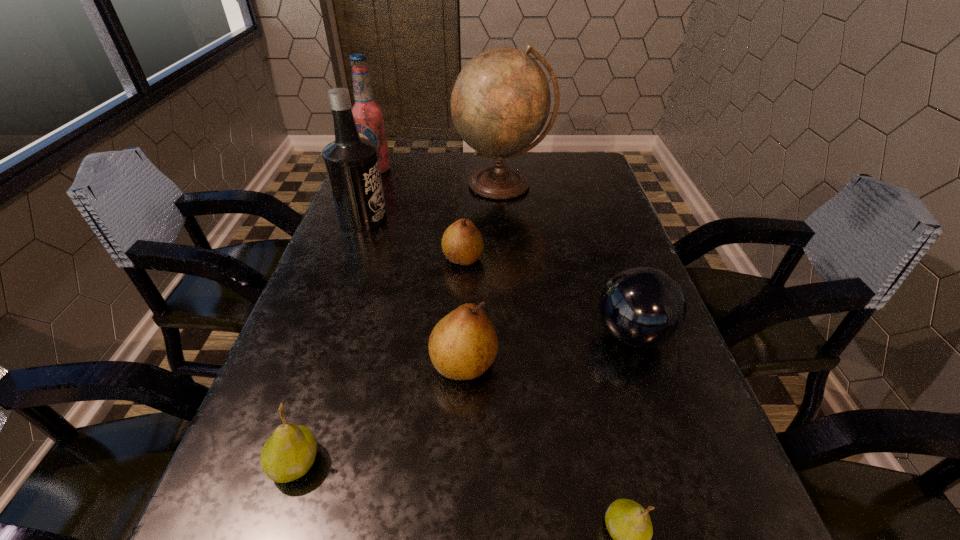
Where is `vacant space that satisfies the following two spatial constraints: 1. on the front-facing side of the globe; 2. on the front label of the liquor`? This screenshot has height=540, width=960. vacant space that satisfies the following two spatial constraints: 1. on the front-facing side of the globe; 2. on the front label of the liquor is located at coordinates (505, 219).

At what (x,y) coordinates should I click in order to perform the action: click on free space that satisfies the following two spatial constraints: 1. on the back side of the seventh farthest object; 2. on the front label of the black liquor. Please return your answer as a coordinate pair (x, y). This screenshot has height=540, width=960. Looking at the image, I should click on (374, 219).

Where is `vacant area that satisfies the following two spatial constraints: 1. on the back side of the smaller brown pear; 2. on the front label of the liquor`? The width and height of the screenshot is (960, 540). vacant area that satisfies the following two spatial constraints: 1. on the back side of the smaller brown pear; 2. on the front label of the liquor is located at coordinates (466, 219).